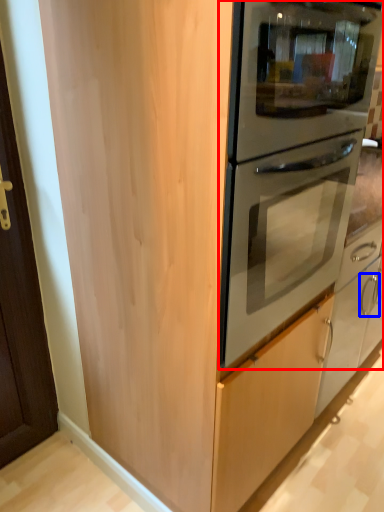
Question: Which point is closer to the camera, oven (highlighted by a red box) or door handle (highlighted by a blue box)?

Choices:
 (A) oven
 (B) door handle

Answer: (A)